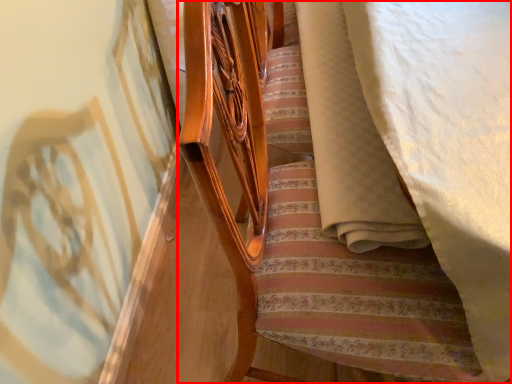
Question: From the image's perspective, considering the relative positions of furniture (annotated by the red box) and blanket in the image provided, where is furniture (annotated by the red box) located with respect to the staircase?

Choices:
 (A) above
 (B) below

Answer: (B)